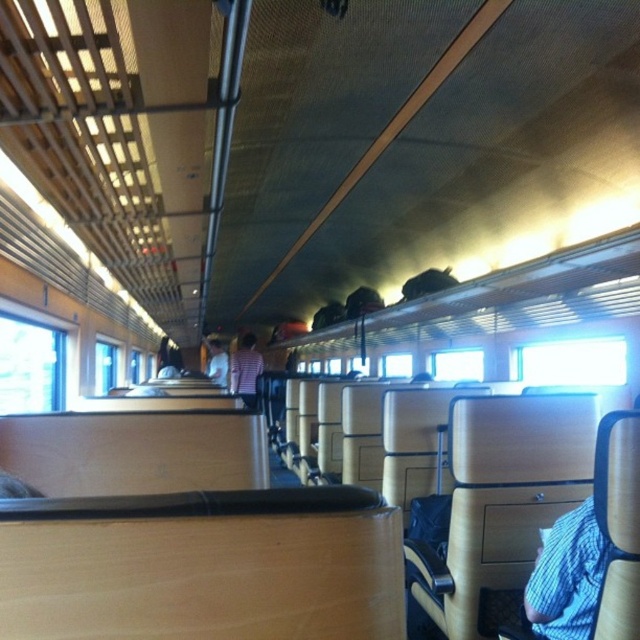
You are a passenger on the train and need to store your backpack. You see the blue knitted sweater at lower right and the white fabric shirt at center. Which item takes up more space on the seat?

The white fabric shirt at center takes up more space than the blue knitted sweater at lower right because the blue knitted sweater at lower right occupies less space than white fabric shirt at center.

You are a passenger sitting in the train carriage and you want to retrieve your clothing items. You have a blue knitted sweater at lower right and a white fabric shirt at center. Which clothing item is positioned higher up?

The blue knitted sweater at lower right is above the white fabric shirt at center, so it is positioned higher up.

You are a passenger on the train and need to place a 15 cm tall book on either the blue knitted sweater at lower right or the striped fabric shirt at center. Which item can the book fit on without exceeding its height?

The striped fabric shirt at center is taller than the blue knitted sweater at lower right. Since the book is 15 cm tall, it can fit on the striped fabric shirt at center but not the blue knitted sweater at lower right.